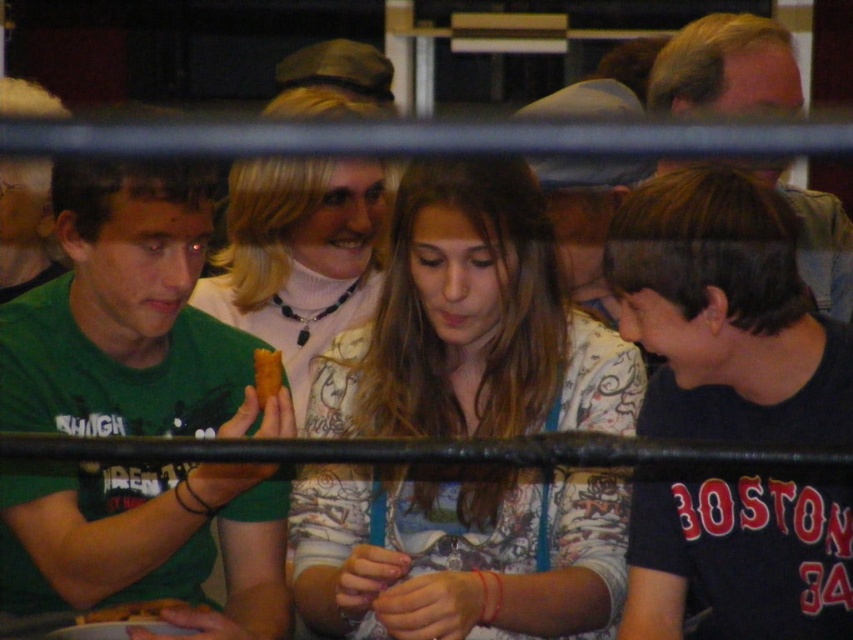
You are a photographer trying to capture a clear shot of both the white turtleneck sweater at center and the golden crispy pastry at lower left. However, the black railing is blocking your view. Can you adjust your position to see both objects without moving the objects themselves?

The golden crispy pastry at lower left is behind the white turtleneck sweater at center, so moving your position might allow you to see around the white turtleneck sweater at center to view the golden crispy pastry at lower left. However, the black railing may still obstruct the view depending on the angle.

You are a photographer trying to capture a clear shot of the black matte shirt at lower right and the golden crispy pastry at lower left. Based on their sizes, which object should you focus on first to ensure it fits within your camera frame?

The black matte shirt at lower right is larger in width than the golden crispy pastry at lower left, so you should focus on capturing the black matte shirt at lower right first to ensure it fits within the camera frame.

You are a photographer trying to capture a candid shot of the group. The white turtleneck sweater at center and the golden crispy pastry at lower left are in your frame. Based on their positions, which object is closer to the camera?

The white turtleneck sweater at center is located above the golden crispy pastry at lower left, so it is closer to the camera.